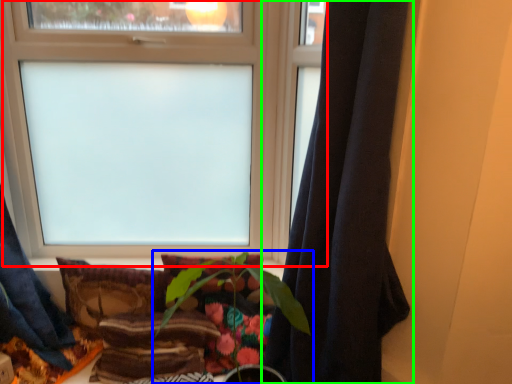
Question: Estimate the real-world distances between objects in this image. Which object is closer to window (highlighted by a red box), houseplant (highlighted by a blue box) or curtain (highlighted by a green box)?

Choices:
 (A) houseplant
 (B) curtain

Answer: (A)